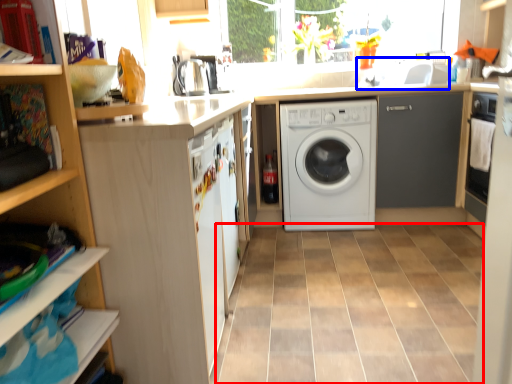
Question: Which of the following is the closest to the observer, ceramic tile (highlighted by a red box) or sink (highlighted by a blue box)?

Choices:
 (A) ceramic tile
 (B) sink

Answer: (A)